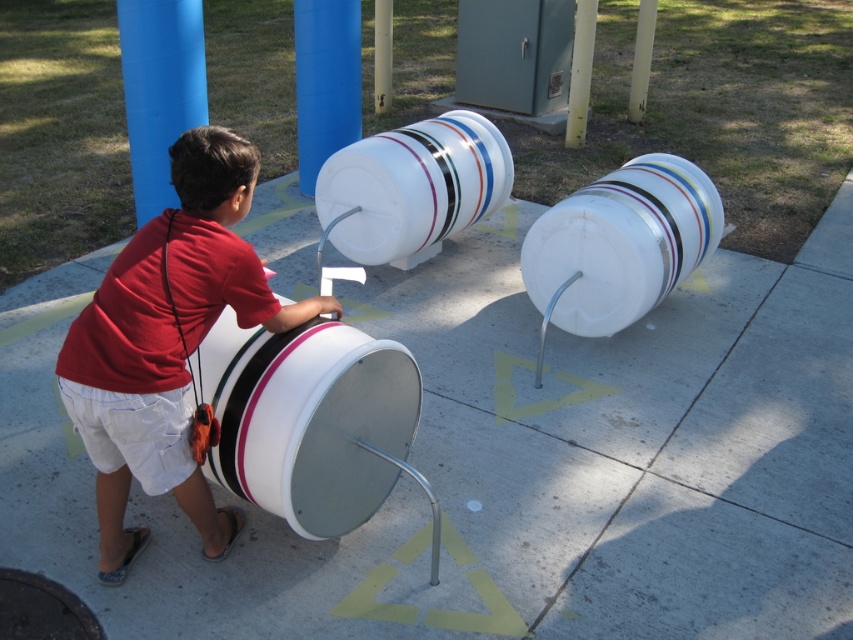
Question: Is white concrete pavement at center wider than white plastic barrel at center?

Choices:
 (A) yes
 (B) no

Answer: (A)

Question: Is blue smooth pole at upper left positioned behind blue plastic pillar at upper center?

Choices:
 (A) yes
 (B) no

Answer: (B)

Question: Which point is farther to the camera?

Choices:
 (A) (247, 204)
 (B) (154, 195)
 (C) (645, 269)

Answer: (B)

Question: Which object appears farthest from the camera in this image?

Choices:
 (A) blue smooth pole at upper left
 (B) white plastic barrel at center
 (C) blue plastic pillar at upper center

Answer: (C)

Question: Is white glossy drum at center positioned at the back of blue smooth pole at upper left?

Choices:
 (A) no
 (B) yes

Answer: (A)

Question: Which point is closer to the camera?

Choices:
 (A) white plastic barrel at center
 (B) white glossy drum at center

Answer: (B)